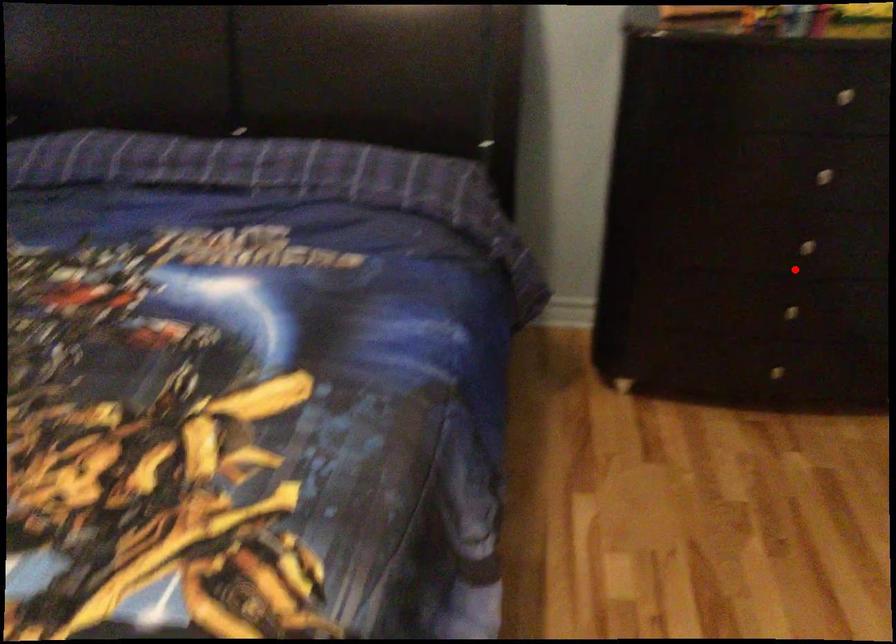
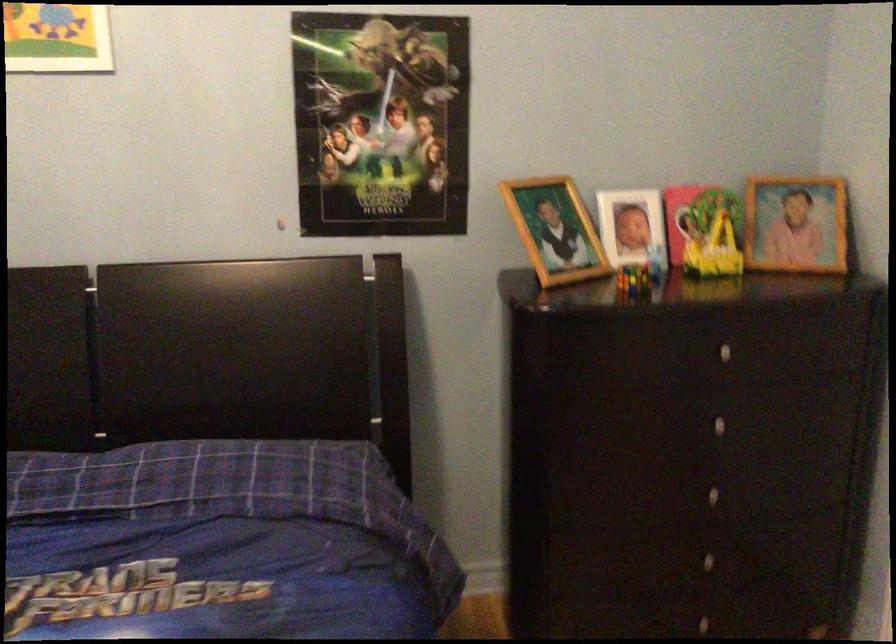
Where in the second image is the point corresponding to the highlighted location from the first image?

(711, 516)